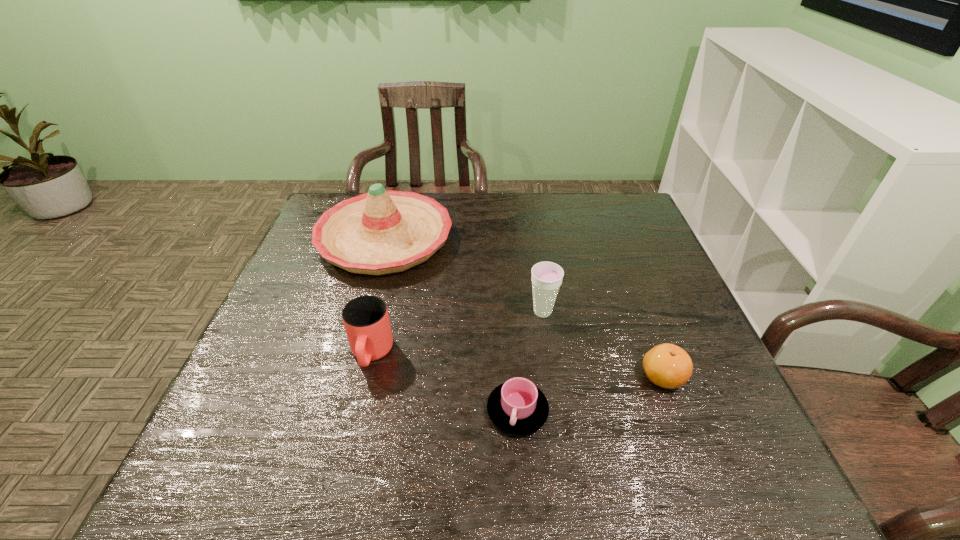
The width and height of the screenshot is (960, 540). In the image, there is a desktop. Find the location of `vacant area at the near right corner`. vacant area at the near right corner is located at coordinates (737, 477).

You are a GUI agent. You are given a task and a screenshot of the screen. Output one action in this format:
    pyautogui.click(x=<x>, y=<y>)
    Task: Click on the vacant space that is in between the tallest object and the clementine
    This screenshot has height=540, width=960.
    Given the screenshot: What is the action you would take?
    pyautogui.click(x=524, y=308)

Image resolution: width=960 pixels, height=540 pixels. I want to click on free point between the shortest object and the farthest cup, so click(530, 361).

At what (x,y) coordinates should I click in order to perform the action: click on free space between the second farthest cup and the shortest object. Please return your answer as a coordinate pair (x, y). Image resolution: width=960 pixels, height=540 pixels. Looking at the image, I should click on (444, 382).

What are the coordinates of `free spot between the farthest object and the leftmost cup` in the screenshot? It's located at (378, 296).

At what (x,y) coordinates should I click in order to perform the action: click on vacant area that lies between the second farthest object and the sombrero. Please return your answer as a coordinate pair (x, y). The image size is (960, 540). Looking at the image, I should click on (464, 275).

Where is `free spot between the shortest cup and the clementine`? free spot between the shortest cup and the clementine is located at coordinates (590, 394).

Identify the location of free space that is in between the farthest cup and the second farthest cup. (457, 333).

At what (x,y) coordinates should I click in order to perform the action: click on free point between the tallest object and the farthest cup. Please return your answer as a coordinate pair (x, y). Looking at the image, I should click on (464, 275).

In order to click on vacant region between the fourth tallest object and the farthest object in this screenshot , I will do `click(524, 308)`.